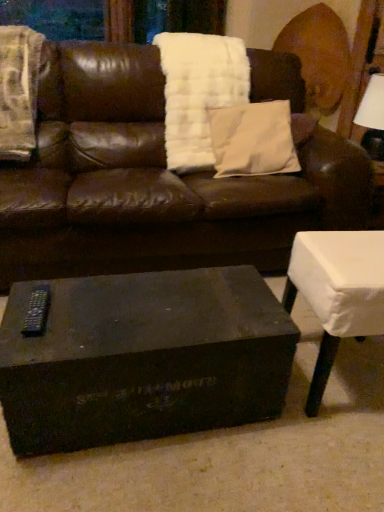
This screenshot has width=384, height=512. I want to click on vacant area in front of matte black coffee table at center, so click(137, 477).